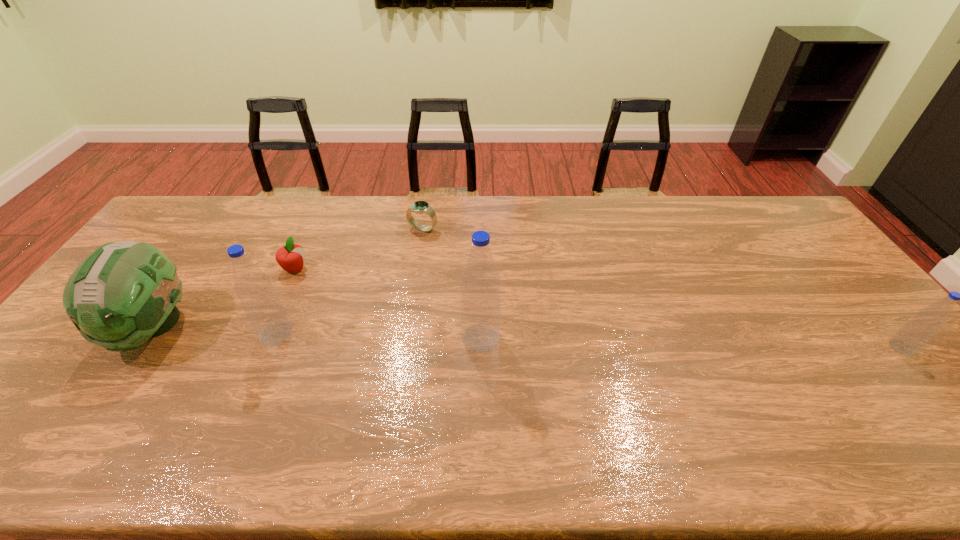
At what (x,y) coordinates should I click in order to perform the action: click on the fifth shortest object. Please return your answer as a coordinate pair (x, y). This screenshot has height=540, width=960. Looking at the image, I should click on (261, 304).

I want to click on the leftmost water bottle, so click(x=261, y=304).

Where is `the fifth object from left to right`? the fifth object from left to right is located at coordinates (480, 283).

What are the coordinates of `the shortest water bottle` in the screenshot? It's located at (918, 331).

The image size is (960, 540). Find the location of `the rightmost object`. the rightmost object is located at coordinates coord(918,331).

You are a GUI agent. You are given a task and a screenshot of the screen. Output one action in this format:
    pyautogui.click(x=<x>, y=<y>)
    Task: Click on the watch
    
    Given the screenshot: What is the action you would take?
    pyautogui.click(x=420, y=207)

You are a GUI agent. You are given a task and a screenshot of the screen. Output one action in this format:
    pyautogui.click(x=<x>, y=<y>)
    Task: Click on the fourth object from left to right
    
    Given the screenshot: What is the action you would take?
    pyautogui.click(x=420, y=207)

The width and height of the screenshot is (960, 540). Find the location of `the leftmost object`. the leftmost object is located at coordinates (124, 293).

The height and width of the screenshot is (540, 960). I want to click on the fourth shortest object, so [124, 293].

This screenshot has width=960, height=540. I want to click on apple, so click(291, 257).